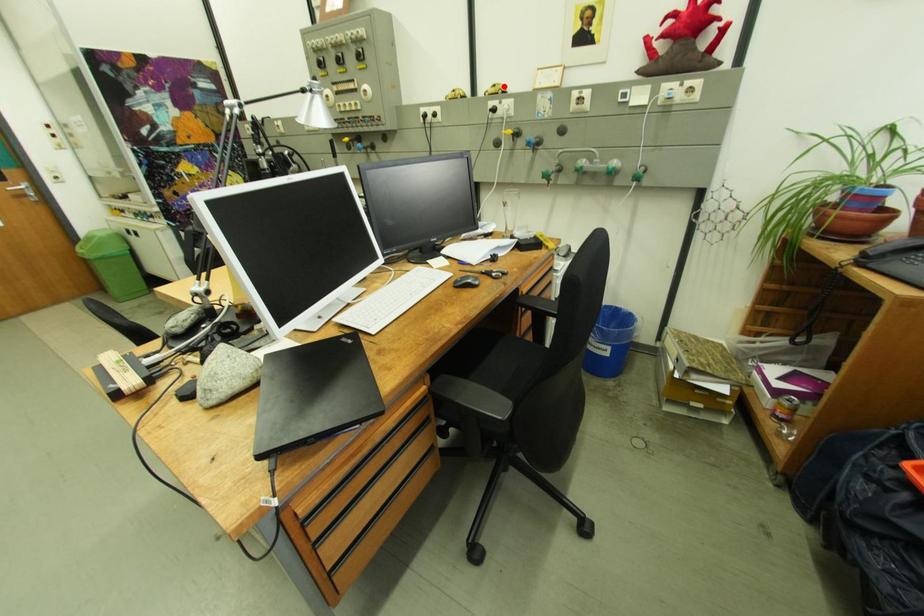
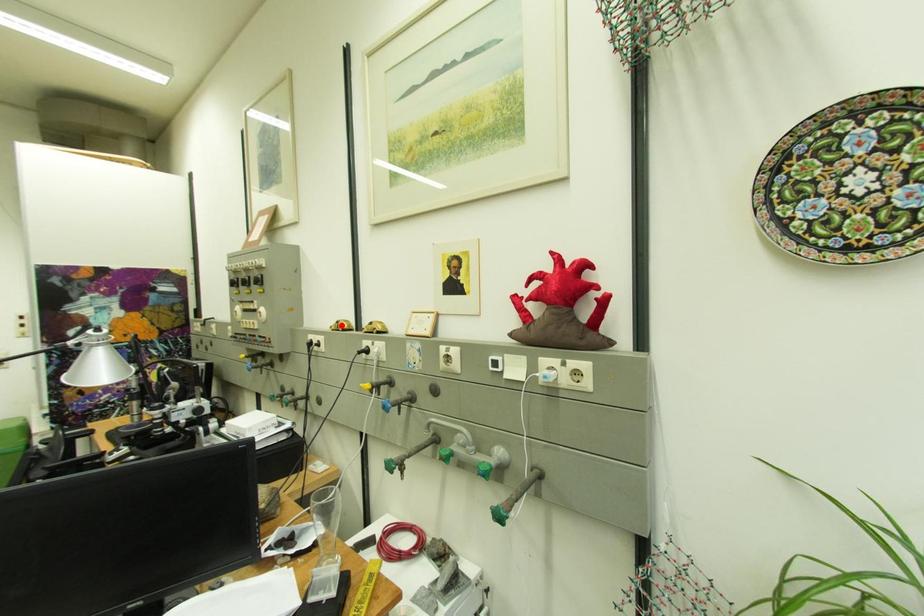
I am providing you with two images of the same scene from different viewpoints. A red point is marked on the first image and another point is marked on the second image. Are the points marked in image1 and image2 representing the same 3D position?

No